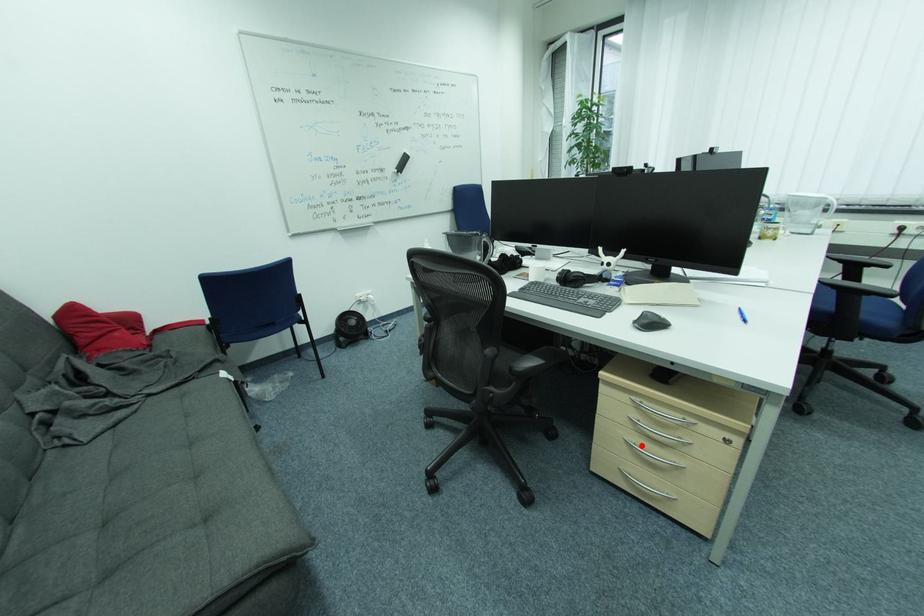
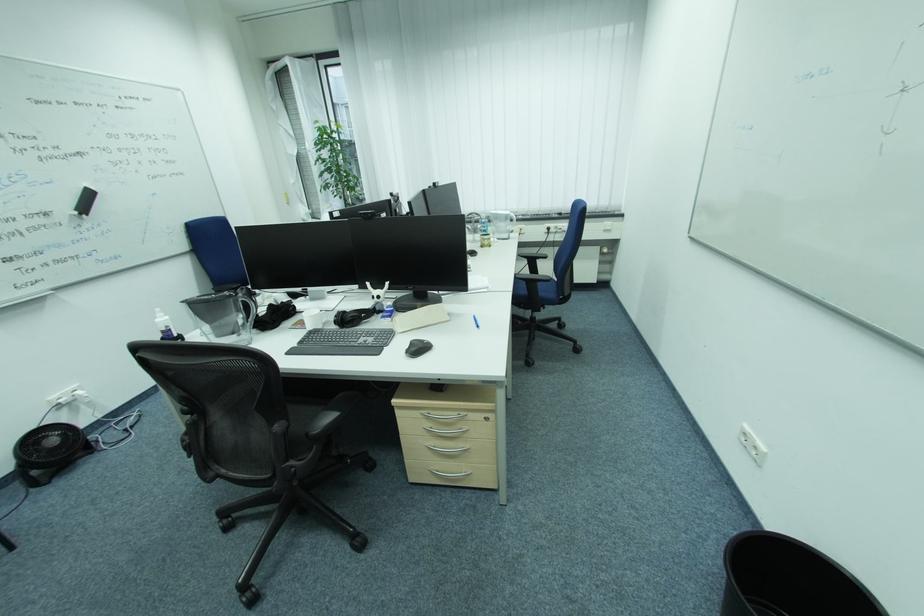
The point at the highlighted location is marked in the first image. Where is the corresponding point in the second image?

(441, 448)